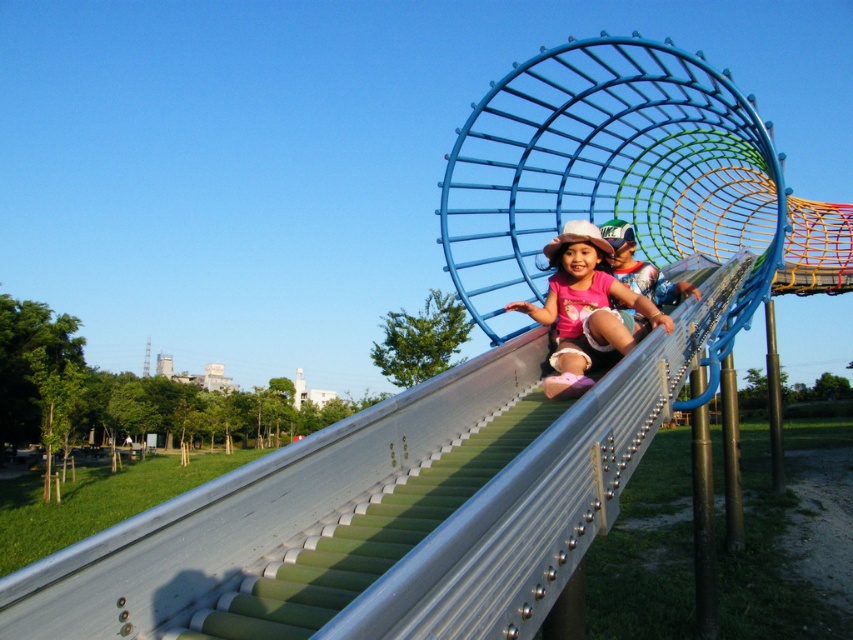
Which is below, pink fabric pants at center or matte pink shirt at center?

pink fabric pants at center

Is pink fabric pants at center above matte pink shirt at center?

No, pink fabric pants at center is not above matte pink shirt at center.

Who is more distant from viewer, (572, 388) or (676, 294)?

The point (676, 294) is more distant.

Identify the location of pink fabric pants at center. (590, 308).